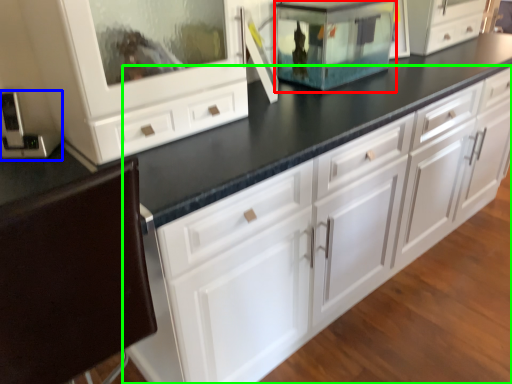
Question: Which object is the closest to the appliance (highlighted by a red box)? Choose among these: appliance (highlighted by a blue box) or chest of drawers (highlighted by a green box).

Choices:
 (A) appliance
 (B) chest of drawers

Answer: (B)